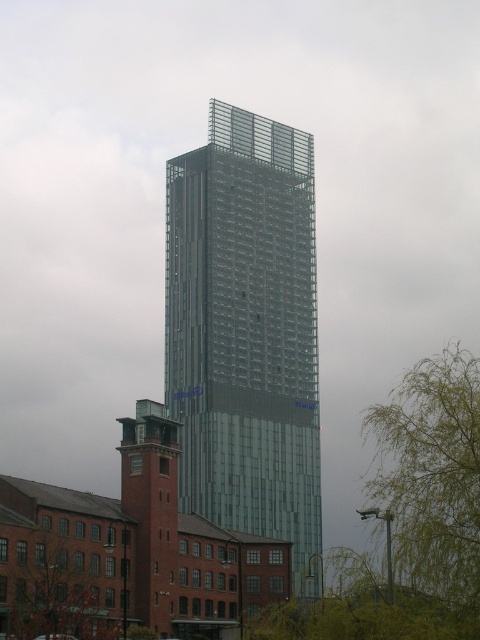
Question: Which of these objects is positioned closest to the green leafy tree at center?

Choices:
 (A) transparent glass tower at center
 (B) green leafy tree at lower left

Answer: (B)

Question: Which point is closer to the camera taking this photo?

Choices:
 (A) (290, 602)
 (B) (207, 477)
 (C) (16, 579)

Answer: (C)

Question: Can you confirm if green leafy tree at center is bigger than green leafy tree at lower left?

Choices:
 (A) yes
 (B) no

Answer: (A)

Question: Can you confirm if transparent glass tower at center is smaller than green leafy tree at center?

Choices:
 (A) no
 (B) yes

Answer: (B)

Question: Can you confirm if transparent glass tower at center is thinner than green leafy tree at lower left?

Choices:
 (A) yes
 (B) no

Answer: (B)

Question: Which of these objects is positioned closest to the green leafy tree at lower left?

Choices:
 (A) transparent glass tower at center
 (B) green leafy tree at center

Answer: (B)